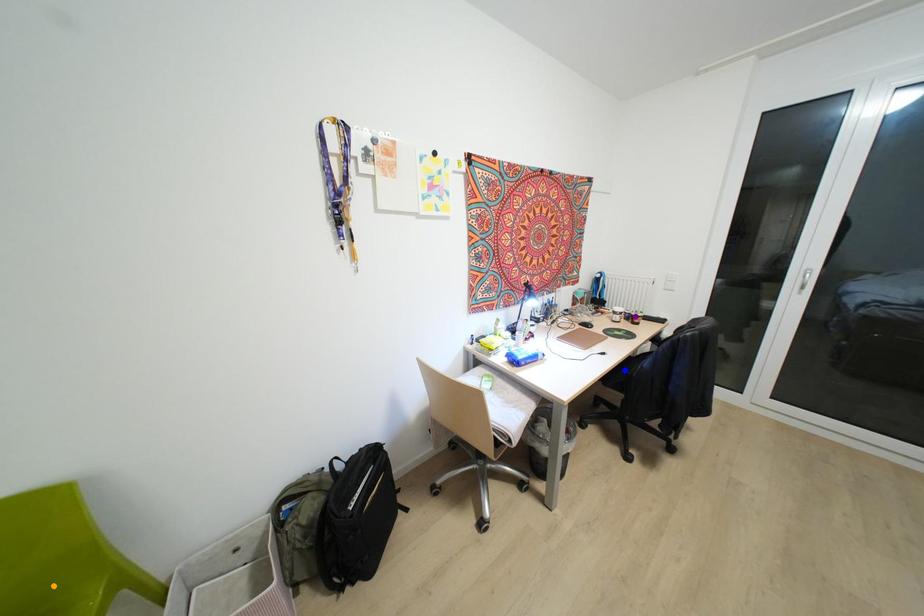
Order these from nearest to farthest:
A) blue point
B) orange point
C) purple point

orange point, blue point, purple point